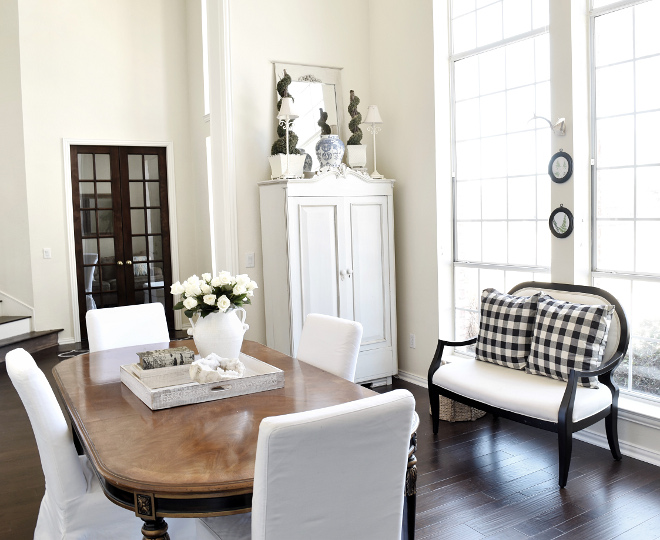
The height and width of the screenshot is (540, 660). What are the coordinates of `cabinet` in the screenshot? It's located at (354, 275).